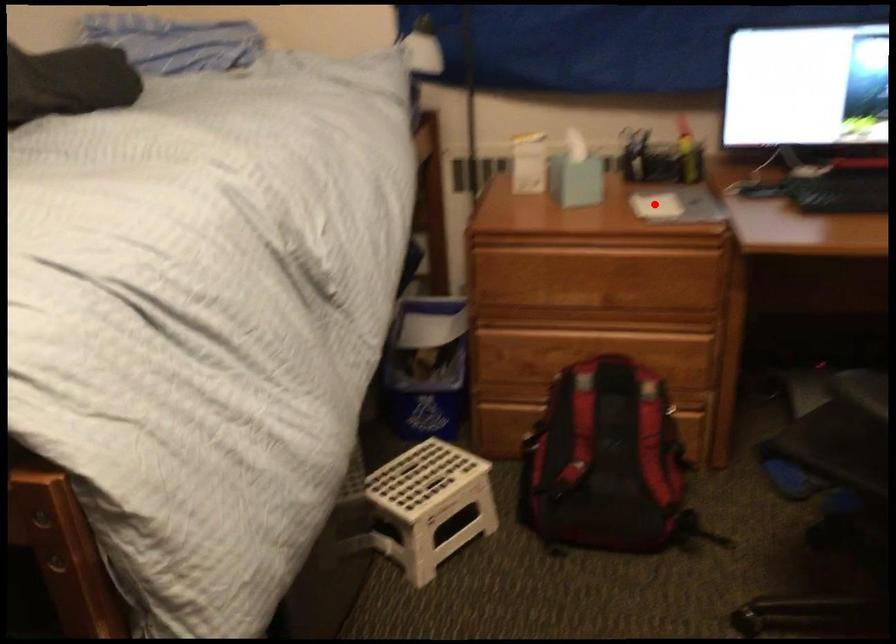
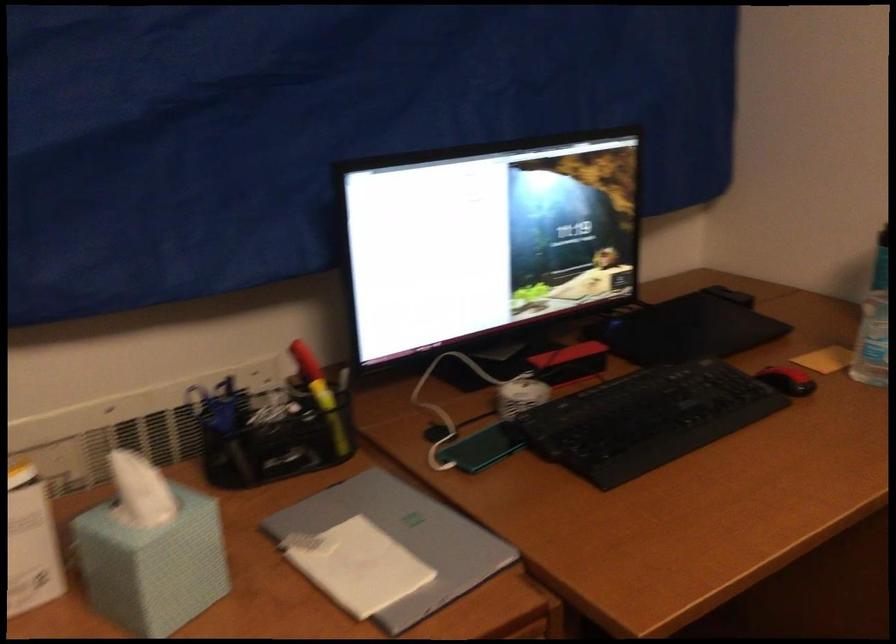
Question: I am providing you with two images of the same scene from different viewpoints. Image1 has a red point marked. In image2, the corresponding 3D location appears at what relative position? Reply with the corresponding letter.

Choices:
 (A) Closer
 (B) Farther

Answer: (A)